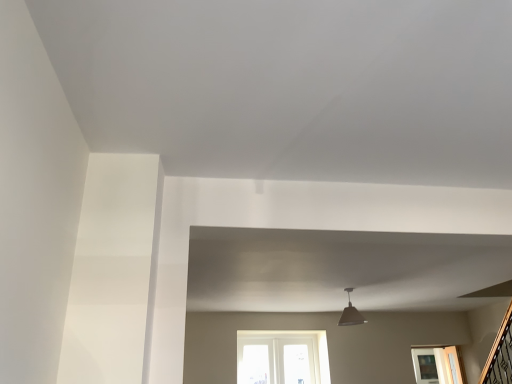
Question: Is matte gray lampshade at upper center next to clear glass cabinet at lower right and touching it?

Choices:
 (A) no
 (B) yes

Answer: (A)

Question: Does matte gray lampshade at upper center lie behind clear glass cabinet at lower right?

Choices:
 (A) yes
 (B) no

Answer: (B)

Question: Does matte gray lampshade at upper center appear on the left side of clear glass cabinet at lower right?

Choices:
 (A) yes
 (B) no

Answer: (A)

Question: Is matte gray lampshade at upper center oriented towards clear glass cabinet at lower right?

Choices:
 (A) yes
 (B) no

Answer: (B)

Question: Is matte gray lampshade at upper center smaller than clear glass cabinet at lower right?

Choices:
 (A) yes
 (B) no

Answer: (A)

Question: From the image's perspective, would you say matte gray lampshade at upper center is positioned over clear glass cabinet at lower right?

Choices:
 (A) yes
 (B) no

Answer: (A)

Question: Is clear glass cabinet at lower right located outside matte gray lampshade at upper center?

Choices:
 (A) no
 (B) yes

Answer: (B)

Question: Does clear glass cabinet at lower right have a smaller size compared to matte gray lampshade at upper center?

Choices:
 (A) yes
 (B) no

Answer: (B)

Question: Does clear glass cabinet at lower right have a greater width compared to matte gray lampshade at upper center?

Choices:
 (A) yes
 (B) no

Answer: (A)

Question: Is matte gray lampshade at upper center a part of clear glass cabinet at lower right?

Choices:
 (A) yes
 (B) no

Answer: (B)

Question: Does clear glass cabinet at lower right come behind matte gray lampshade at upper center?

Choices:
 (A) no
 (B) yes

Answer: (B)

Question: Is clear glass cabinet at lower right beside matte gray lampshade at upper center?

Choices:
 (A) no
 (B) yes

Answer: (A)

Question: Looking at the image, does clear glass cabinet at lower right seem bigger or smaller compared to matte gray lampshade at upper center?

Choices:
 (A) small
 (B) big

Answer: (B)